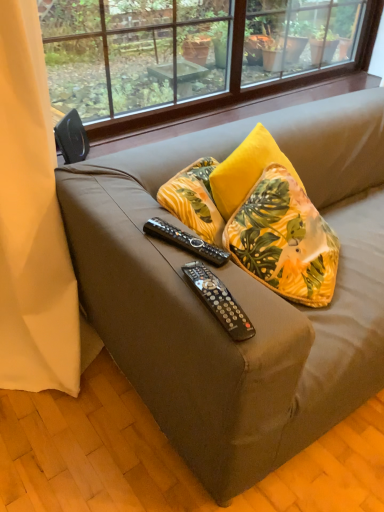
Find the location of a particular element. transparent glass window at upper center is located at coordinates (239, 80).

Measure the distance between beige fabric curtain at left and camera.

37.68 inches.

Find the location of a particular element. beige fabric curtain at left is located at coordinates click(34, 225).

The image size is (384, 512). I want to click on black plastic remote control at center, the 1th remote control in the back-to-front sequence, so click(x=185, y=241).

Where is `black plastic remote at center, arranged as the second remote control when viewed from the top`? black plastic remote at center, arranged as the second remote control when viewed from the top is located at coordinates coord(219,301).

What do you see at coordinates (284, 240) in the screenshot?
I see `yellow fabric pillow at upper right` at bounding box center [284, 240].

Where is `yellow fabric pillow at upper right`? This screenshot has width=384, height=512. yellow fabric pillow at upper right is located at coordinates (284, 240).

At what (x,y) coordinates should I click in order to perform the action: click on transparent glass window at upper center. Please return your answer as a coordinate pair (x, y). Image resolution: width=384 pixels, height=512 pixels. Looking at the image, I should click on (239, 80).

Is yellow fabric pillow at upper right shorter than matte brown couch at center?

Yes, yellow fabric pillow at upper right is shorter than matte brown couch at center.

Can you confirm if yellow fabric pillow at upper right is wider than matte brown couch at center?

In fact, yellow fabric pillow at upper right might be narrower than matte brown couch at center.

In the image, is yellow fabric pillow at upper right on the left side or the right side of matte brown couch at center?

yellow fabric pillow at upper right is to the left of matte brown couch at center.

Between yellow fabric pillow at upper right and matte brown couch at center, which one is positioned behind?

yellow fabric pillow at upper right is behind.

Between point (228, 323) and point (227, 256), which one is positioned behind?

The point (227, 256) is behind.

Is black plastic remote at center, the 1th remote control in the front-to-back sequence, located outside black plastic remote control at center, positioned as the 2th remote control in front-to-back order?

Indeed, black plastic remote at center, the 1th remote control in the front-to-back sequence, is completely outside black plastic remote control at center, positioned as the 2th remote control in front-to-back order.

Find the location of a particular element. The image size is (384, 512). remote control directly beneath the black plastic remote at center, which is counted as the first remote control, starting from the bottom (from a real-world perspective) is located at coordinates (185, 241).

Does matte brown couch at center have a smaller size compared to transparent glass window at upper center?

No, matte brown couch at center is not smaller than transparent glass window at upper center.

From a real-world perspective, does matte brown couch at center stand above transparent glass window at upper center?

No, from a real-world perspective, matte brown couch at center is not above transparent glass window at upper center.

The height and width of the screenshot is (512, 384). In order to click on studio couch below the transparent glass window at upper center (from the image's perspective) in this screenshot , I will do `click(237, 295)`.

Measure the distance between black plastic remote at center, the 1th remote control in the front-to-back sequence, and transparent glass window at upper center.

A distance of 4.35 feet exists between black plastic remote at center, the 1th remote control in the front-to-back sequence, and transparent glass window at upper center.

How different are the orientations of black plastic remote at center, the 1th remote control in the front-to-back sequence, and transparent glass window at upper center in degrees?

The angular difference between black plastic remote at center, the 1th remote control in the front-to-back sequence, and transparent glass window at upper center is 11.7 degrees.

From a real-world perspective, is black plastic remote at center, the 1th remote control in the front-to-back sequence, above or below transparent glass window at upper center?

In terms of real-world spatial position, black plastic remote at center, the 1th remote control in the front-to-back sequence, is below transparent glass window at upper center.

Is black plastic remote at center, which is counted as the first remote control, starting from the bottom, facing towards transparent glass window at upper center?

No.

Is yellow fabric pillow at upper right shorter than black plastic remote control at center, positioned as the 2th remote control in front-to-back order?

No.

Between yellow fabric pillow at upper right and black plastic remote control at center, which is the first remote control in top-to-bottom order, which one has smaller size?

With smaller size is black plastic remote control at center, which is the first remote control in top-to-bottom order.

Would you say black plastic remote control at center, positioned as the 2th remote control in front-to-back order, is part of yellow fabric pillow at upper right's contents?

No, black plastic remote control at center, positioned as the 2th remote control in front-to-back order, is not inside yellow fabric pillow at upper right.

Does yellow fabric pillow at upper right have a lesser height compared to black plastic remote at center, which is counted as the first remote control, starting from the bottom?

No.

Do you think yellow fabric pillow at upper right is within black plastic remote at center, the 1th remote control in the front-to-back sequence, or outside of it?

yellow fabric pillow at upper right cannot be found inside black plastic remote at center, the 1th remote control in the front-to-back sequence.

Is yellow fabric pillow at upper right next to black plastic remote at center, which is counted as the first remote control, starting from the bottom, and touching it?

No, yellow fabric pillow at upper right is not touching black plastic remote at center, which is counted as the first remote control, starting from the bottom.

Locate an element on the screen. The height and width of the screenshot is (512, 384). pillow on the right of beige fabric curtain at left is located at coordinates (284, 240).

From the image's perspective, which is above, yellow fabric pillow at upper right or beige fabric curtain at left?

yellow fabric pillow at upper right is shown above in the image.

Considering the sizes of objects yellow fabric pillow at upper right and beige fabric curtain at left in the image provided, who is wider, yellow fabric pillow at upper right or beige fabric curtain at left?

With larger width is beige fabric curtain at left.

Which object is positioned more to the right, yellow fabric pillow at upper right or beige fabric curtain at left?

From the viewer's perspective, yellow fabric pillow at upper right appears more on the right side.

At what (x,y) coordinates should I click in order to perform the action: click on pillow positioned vertically above the matte brown couch at center (from a real-world perspective). Please return your answer as a coordinate pair (x, y). This screenshot has width=384, height=512. Looking at the image, I should click on (284, 240).

At what (x,y) coordinates should I click in order to perform the action: click on remote control on the right of the black plastic remote control at center, positioned as the 2th remote control in front-to-back order. Please return your answer as a coordinate pair (x, y). Image resolution: width=384 pixels, height=512 pixels. Looking at the image, I should click on (219, 301).

When comparing their distances from transparent glass window at upper center, does yellow fabric pillow at upper right or black plastic remote control at center, which is the 2th remote control from bottom to top, seem further?

Based on the image, black plastic remote control at center, which is the 2th remote control from bottom to top, appears to be further to transparent glass window at upper center.

Looking at the image, which one is located further to matte brown couch at center, black plastic remote at center, which is counted as the first remote control, starting from the bottom, or yellow fabric pillow at upper right?

Based on the image, black plastic remote at center, which is counted as the first remote control, starting from the bottom, appears to be further to matte brown couch at center.

Which object lies nearer to the anchor point beige fabric curtain at left, black plastic remote at center, which is counted as the first remote control, starting from the bottom, or yellow fabric pillow at upper right?

The object closer to beige fabric curtain at left is yellow fabric pillow at upper right.

Estimate the real-world distances between objects in this image. Which object is closer to black plastic remote at center, which is the 2th remote control in back-to-front order, yellow fabric pillow at upper right or transparent glass window at upper center?

yellow fabric pillow at upper right is closer to black plastic remote at center, which is the 2th remote control in back-to-front order.

Considering their positions, is beige fabric curtain at left positioned closer to yellow fabric pillow at upper right than black plastic remote control at center, positioned as the 2th remote control in front-to-back order?

black plastic remote control at center, positioned as the 2th remote control in front-to-back order, is closer to yellow fabric pillow at upper right.

From the image, which object appears to be farther from transparent glass window at upper center, black plastic remote at center, which is the 2th remote control in back-to-front order, or matte brown couch at center?

Among the two, black plastic remote at center, which is the 2th remote control in back-to-front order, is located further to transparent glass window at upper center.

Looking at the image, which one is located further to beige fabric curtain at left, matte brown couch at center or black plastic remote control at center, which is the first remote control in top-to-bottom order?

black plastic remote control at center, which is the first remote control in top-to-bottom order, is further to beige fabric curtain at left.

Consider the image. Estimate the real-world distances between objects in this image. Which object is further from yellow fabric pillow at upper right, black plastic remote at center, which is counted as the first remote control, starting from the bottom, or black plastic remote control at center, which is the 2th remote control from bottom to top?

black plastic remote at center, which is counted as the first remote control, starting from the bottom, lies further to yellow fabric pillow at upper right than the other object.

The height and width of the screenshot is (512, 384). Find the location of `remote control between black plastic remote control at center, which is the first remote control in top-to-bottom order, and yellow fabric pillow at upper right from left to right`. remote control between black plastic remote control at center, which is the first remote control in top-to-bottom order, and yellow fabric pillow at upper right from left to right is located at coordinates (219, 301).

What are the coordinates of `pillow between black plastic remote at center, which is the 2th remote control in back-to-front order, and matte brown couch at center` in the screenshot? It's located at (284, 240).

What are the coordinates of `pillow between transparent glass window at upper center and black plastic remote control at center, which is the 2th remote control from bottom to top, from top to bottom` in the screenshot? It's located at (284, 240).

You are a GUI agent. You are given a task and a screenshot of the screen. Output one action in this format:
    pyautogui.click(x=<x>, y=<y>)
    Task: Click on the pillow between black plastic remote control at center, which is the 2th remote control from bottom to top, and matte brown couch at center
    The width and height of the screenshot is (384, 512).
    Given the screenshot: What is the action you would take?
    pyautogui.click(x=284, y=240)